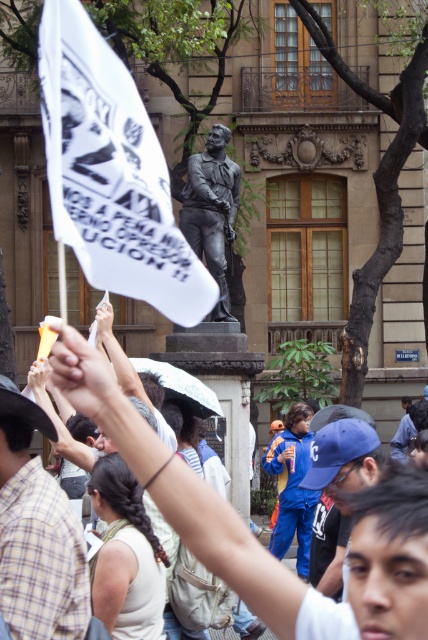
Question: Which of the following is the closest to the observer?

Choices:
 (A) bronze statue at center
 (B) white paper flag at upper left
 (C) plaid shirt at center
 (D) blue fabric cap at center

Answer: (B)

Question: Is plaid shirt at center above bronze statue at center?

Choices:
 (A) no
 (B) yes

Answer: (A)

Question: Estimate the real-world distances between objects in this image. Which object is closer to the blue fabric cap at center?

Choices:
 (A) plaid shirt at center
 (B) white paper flag at upper left

Answer: (A)

Question: Which of the following is the closest to the observer?

Choices:
 (A) (21, 484)
 (B) (332, 500)
 (C) (214, 147)
 (D) (74, 218)

Answer: (D)

Question: Can you confirm if white paper flag at upper left is bigger than bronze statue at center?

Choices:
 (A) no
 (B) yes

Answer: (A)

Question: Is blue fabric cap at center below bronze statue at center?

Choices:
 (A) yes
 (B) no

Answer: (A)